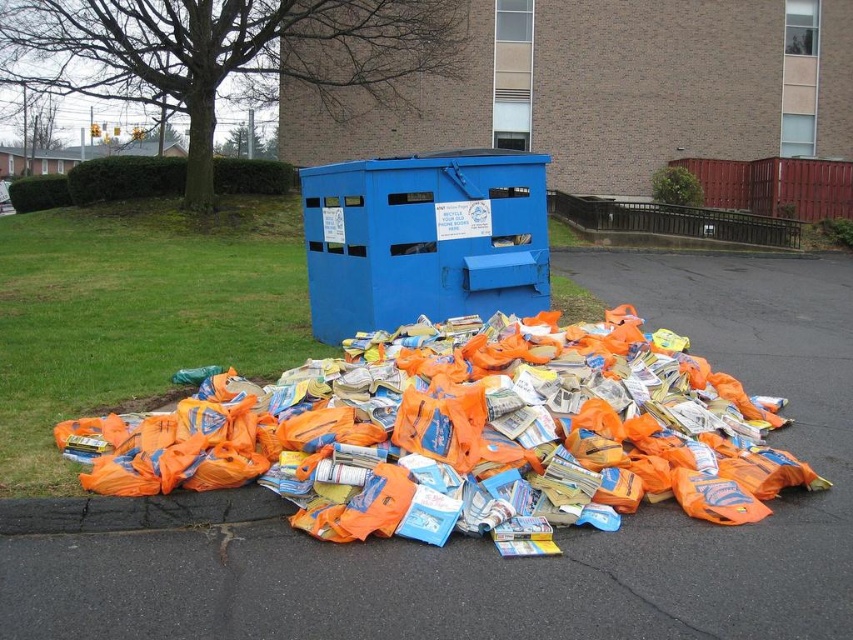
Can you confirm if orange plastic bags at center is bigger than blue metallic dumpster at center?

Yes.

Who is lower down, orange plastic bags at center or blue metallic dumpster at center?

orange plastic bags at center is lower down.

Does point (137, 428) lie in front of point (323, 227)?

Yes, point (137, 428) is in front of point (323, 227).

The height and width of the screenshot is (640, 853). What are the coordinates of `orange plastic bags at center` in the screenshot? It's located at (462, 428).